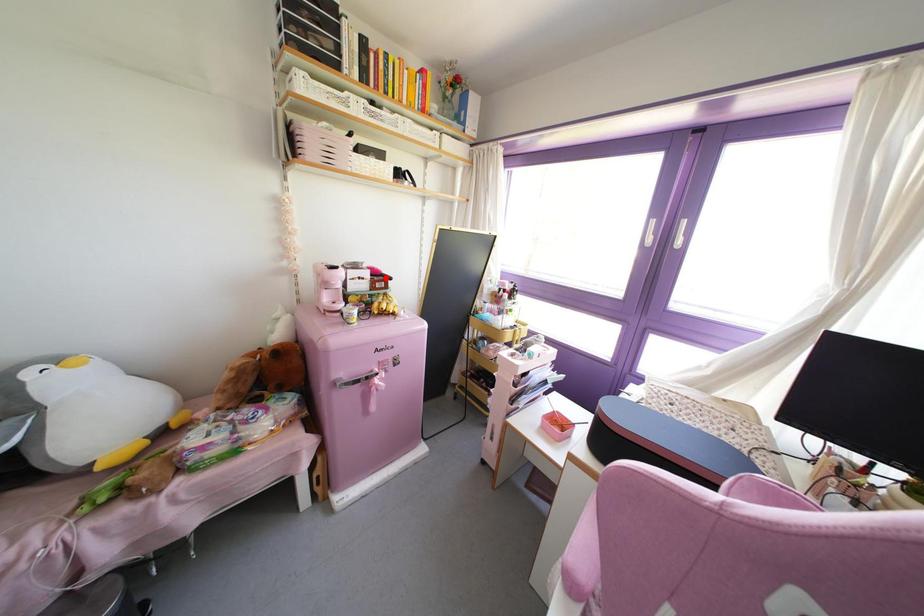
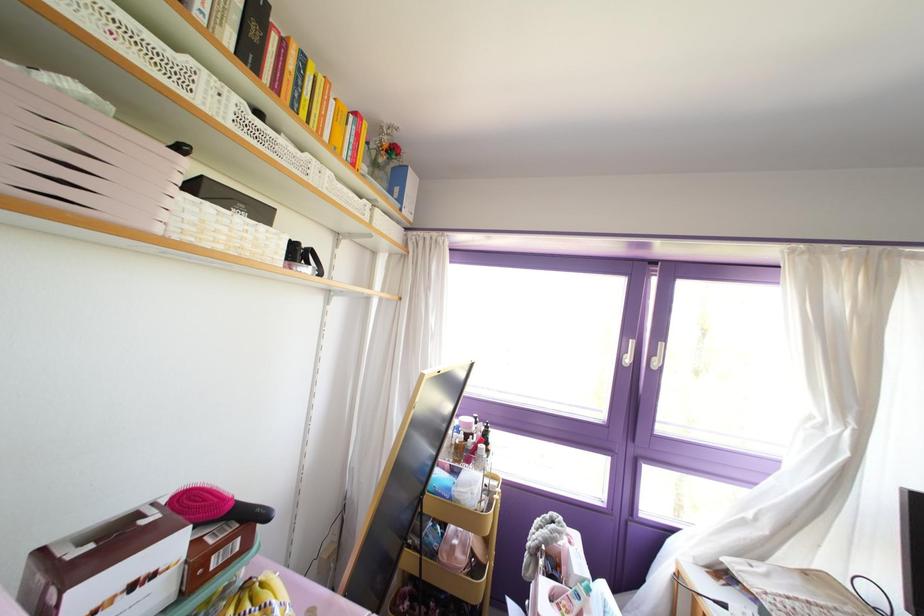
Find the pixel in the second image that matches the highlighted location in the first image.

(251, 517)